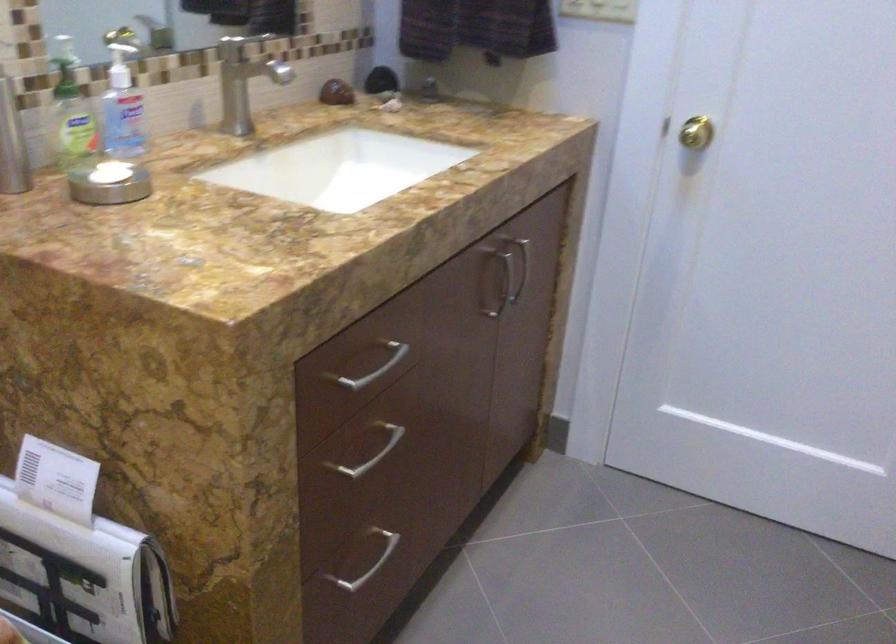
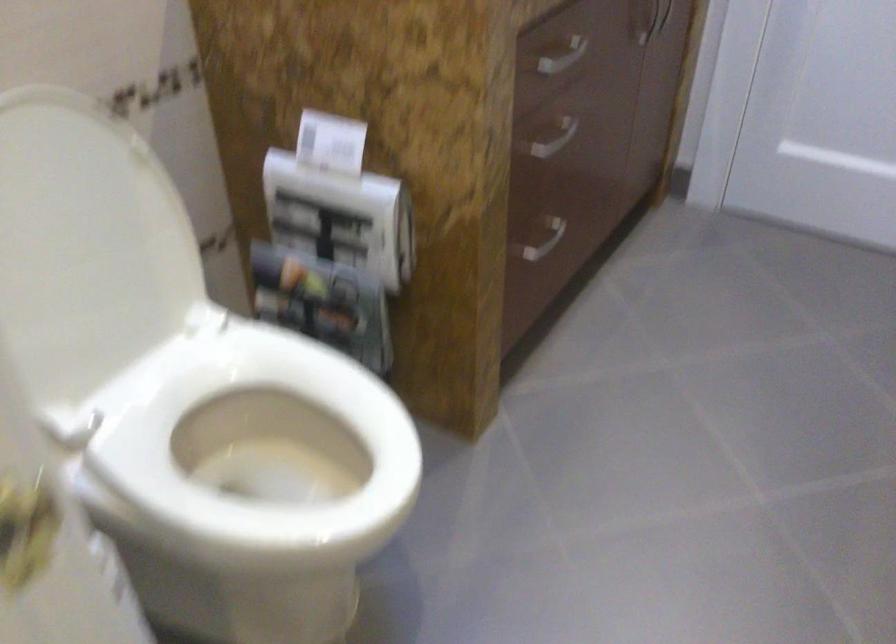
Locate, in the second image, the point that corresponds to (x=383, y=355) in the first image.

(562, 57)